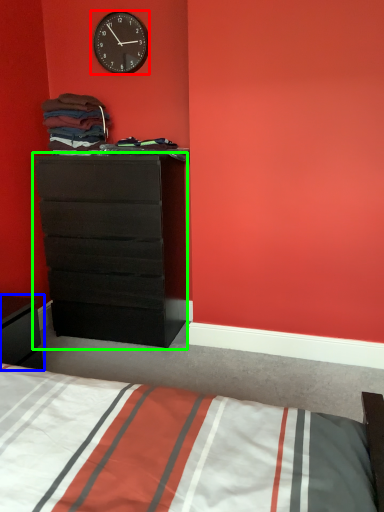
Question: Which object is positioned farthest from wall clock (highlighted by a red box)? Select from nightstand (highlighted by a blue box) and chest of drawers (highlighted by a green box).

Choices:
 (A) nightstand
 (B) chest of drawers

Answer: (A)